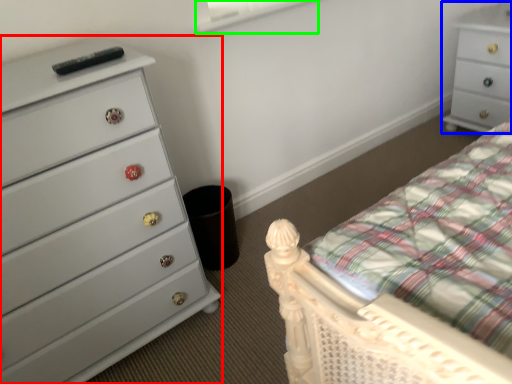
Question: Which is farther away from chest of drawers (highlighted by a red box)? chest of drawers (highlighted by a blue box) or window screen (highlighted by a green box)?

Choices:
 (A) chest of drawers
 (B) window screen

Answer: (A)